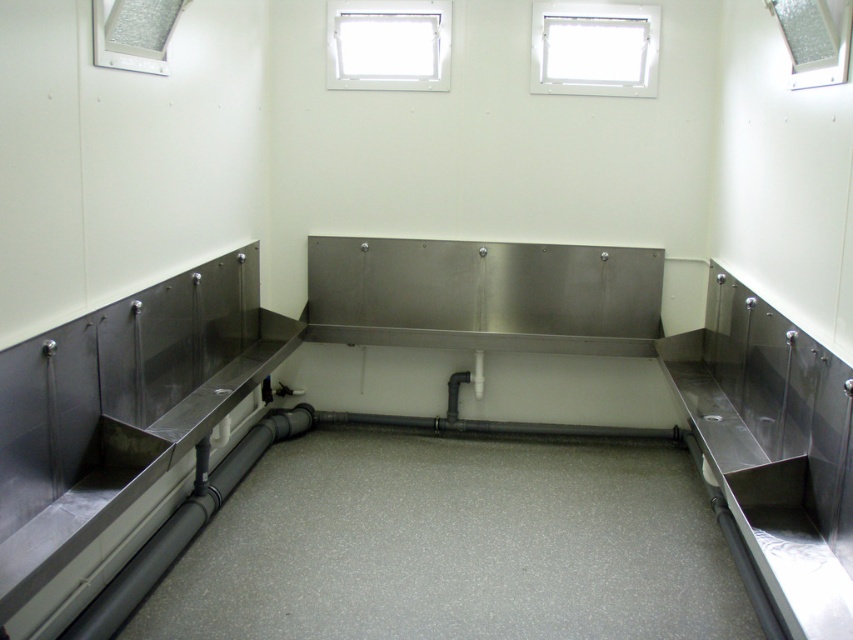
You are a maintenance worker needing to replace a window in this utility room. You have a replacement window that is 1.2 meters wide. Which window between the transparent plastic window at upper center and the clear glass window at upper right can the new window fit into?

The transparent plastic window at upper center might be wider than the clear glass window at upper right, so the replacement window that is 1.2 meters wide could fit into the transparent plastic window at upper center if its width matches or exceeds 1.2 meters. However, without exact measurements, it is uncertain.

You are standing in the utility room and need to locate the clear glass window at upper right. According to the coordinates provided, where exactly would you find it?

The clear glass window at upper right is located at the coordinates point (814,38).